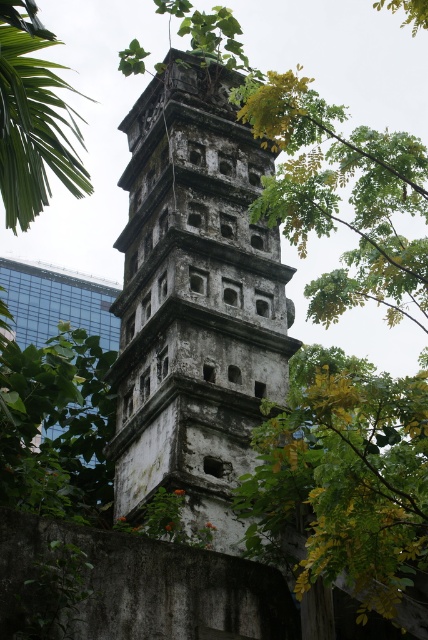
Question: Which is nearer to the weathered stone tower at center?

Choices:
 (A) green leafy tree at center
 (B) green leafy tree at left

Answer: (B)

Question: Can you confirm if green leafy tree at center is wider than green leafy tree at left?

Choices:
 (A) yes
 (B) no

Answer: (B)

Question: Does weathered stone tower at center appear on the left side of green leafy tree at center?

Choices:
 (A) yes
 (B) no

Answer: (A)

Question: Can you confirm if green leafy tree at center is positioned to the right of green leafy tree at left?

Choices:
 (A) yes
 (B) no

Answer: (A)

Question: Which of the following is the farthest from the observer?

Choices:
 (A) (18, 170)
 (B) (302, 467)
 (C) (276, 314)

Answer: (C)

Question: Which point is closer to the camera?

Choices:
 (A) weathered stone tower at center
 (B) green leafy tree at center
 (C) green leafy tree at left

Answer: (B)